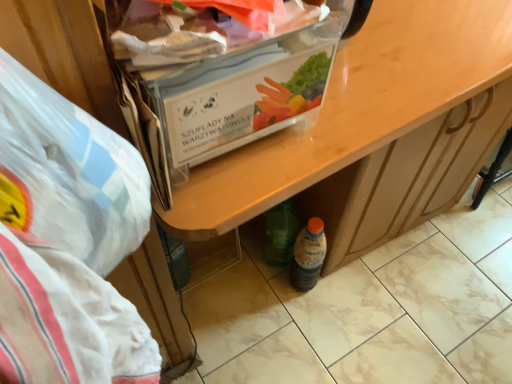
Question: Does clear plastic box at upper center come in front of white plastic bag at left?

Choices:
 (A) no
 (B) yes

Answer: (A)

Question: Does clear plastic box at upper center have a greater width compared to white plastic bag at left?

Choices:
 (A) no
 (B) yes

Answer: (B)

Question: Considering the relative sizes of clear plastic box at upper center and white plastic bag at left in the image provided, is clear plastic box at upper center thinner than white plastic bag at left?

Choices:
 (A) no
 (B) yes

Answer: (A)

Question: Is clear plastic box at upper center shorter than white plastic bag at left?

Choices:
 (A) yes
 (B) no

Answer: (A)

Question: Would you consider clear plastic box at upper center to be distant from white plastic bag at left?

Choices:
 (A) no
 (B) yes

Answer: (A)

Question: Considering the positions of wooden desk at center and clear plastic box at upper center in the image, is wooden desk at center wider or thinner than clear plastic box at upper center?

Choices:
 (A) wide
 (B) thin

Answer: (B)

Question: Based on their sizes in the image, would you say wooden desk at center is bigger or smaller than clear plastic box at upper center?

Choices:
 (A) big
 (B) small

Answer: (A)

Question: From their relative heights in the image, would you say wooden desk at center is taller or shorter than clear plastic box at upper center?

Choices:
 (A) tall
 (B) short

Answer: (A)

Question: From a real-world perspective, is wooden desk at center positioned above or below clear plastic box at upper center?

Choices:
 (A) above
 (B) below

Answer: (B)

Question: Looking at their shapes, would you say translucent plastic bottle at lower center is wider or thinner than clear plastic box at upper center?

Choices:
 (A) thin
 (B) wide

Answer: (A)

Question: Considering the relative positions of translucent plastic bottle at lower center and clear plastic box at upper center in the image provided, is translucent plastic bottle at lower center to the left or to the right of clear plastic box at upper center?

Choices:
 (A) left
 (B) right

Answer: (B)

Question: Considering the positions of translucent plastic bottle at lower center and clear plastic box at upper center in the image, is translucent plastic bottle at lower center taller or shorter than clear plastic box at upper center?

Choices:
 (A) tall
 (B) short

Answer: (A)

Question: In terms of size, does translucent plastic bottle at lower center appear bigger or smaller than clear plastic box at upper center?

Choices:
 (A) big
 (B) small

Answer: (B)

Question: Considering the positions of white plastic bag at left and wooden desk at center in the image, is white plastic bag at left wider or thinner than wooden desk at center?

Choices:
 (A) wide
 (B) thin

Answer: (B)

Question: Based on their sizes in the image, would you say white plastic bag at left is bigger or smaller than wooden desk at center?

Choices:
 (A) big
 (B) small

Answer: (B)